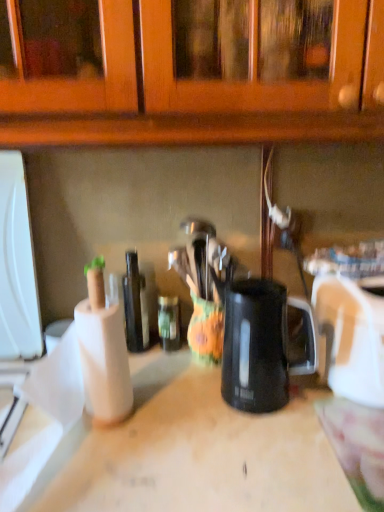
The image size is (384, 512). What are the coordinates of `empty space that is ontop of wooden at center` in the screenshot? It's located at (220, 418).